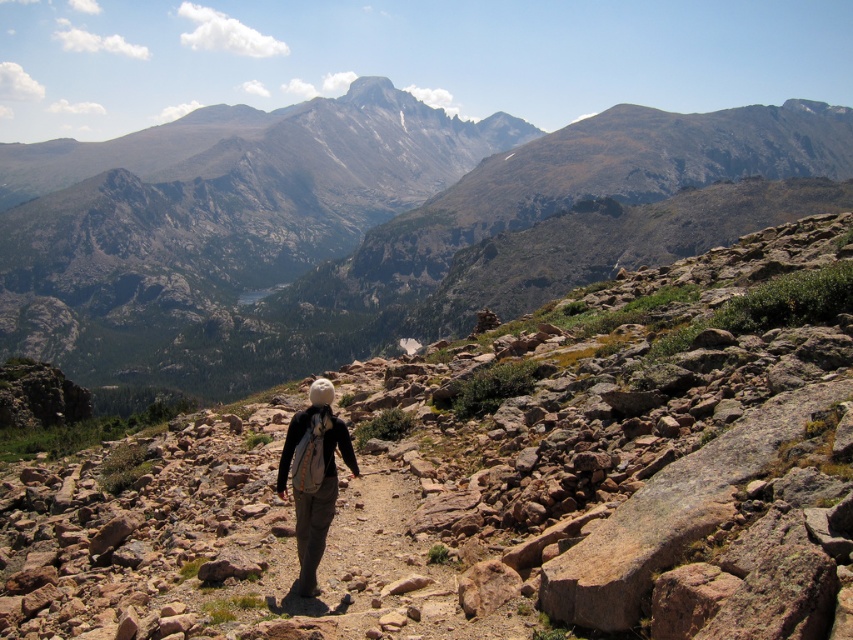
Who is higher up, rugged granite mountain at center or light brown fabric backpack at center?

rugged granite mountain at center

Is point (457, 289) positioned behind point (291, 426)?

Yes, it is.

The width and height of the screenshot is (853, 640). In order to click on rugged granite mountain at center in this screenshot , I will do `click(387, 241)`.